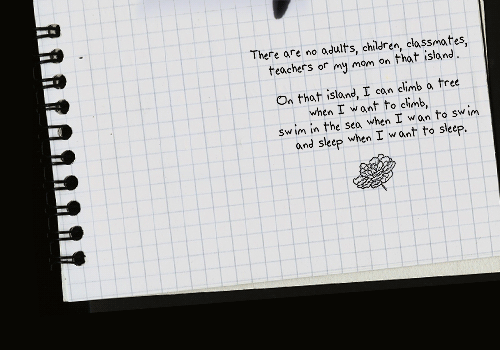
Identify the location of dark gray notebook cover. Image resolution: width=500 pixels, height=350 pixels. (98, 308).